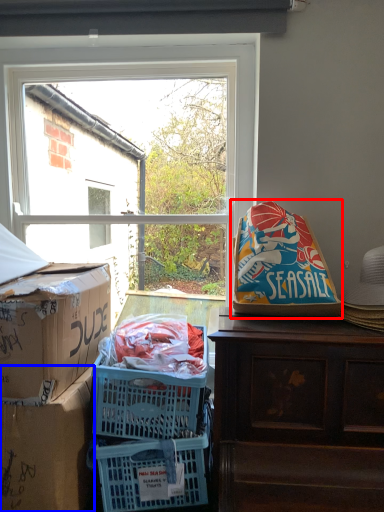
Question: Which object is further to the camera taking this photo, bean bag chair (highlighted by a red box) or box (highlighted by a blue box)?

Choices:
 (A) bean bag chair
 (B) box

Answer: (A)